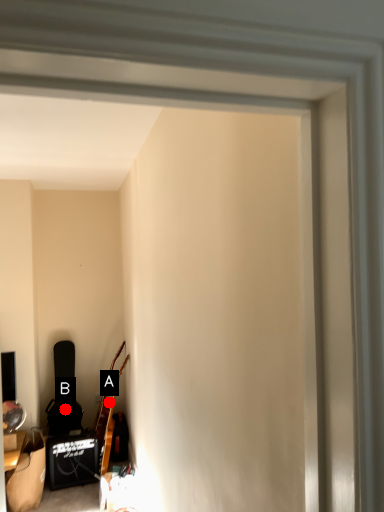
Question: Two points are circled on the image, labeled by A and B beside each circle. Which point is closer to the camera?

Choices:
 (A) A is closer
 (B) B is closer

Answer: (A)